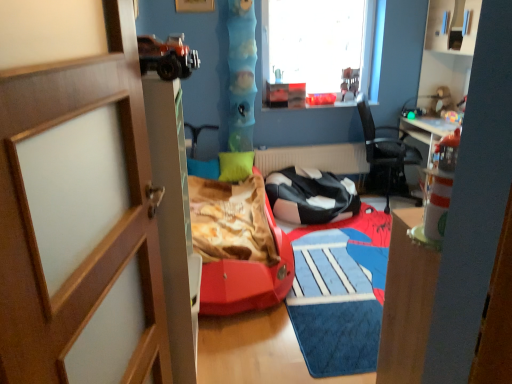
Question: From the image's perspective, is green matte pillow at center under transparent glass window at upper center?

Choices:
 (A) no
 (B) yes

Answer: (B)

Question: Is green matte pillow at center in front of transparent glass window at upper center?

Choices:
 (A) yes
 (B) no

Answer: (A)

Question: Would you say green matte pillow at center contains transparent glass window at upper center?

Choices:
 (A) yes
 (B) no

Answer: (B)

Question: From the image's perspective, is green matte pillow at center on transparent glass window at upper center?

Choices:
 (A) no
 (B) yes

Answer: (A)

Question: Does green matte pillow at center have a greater height compared to transparent glass window at upper center?

Choices:
 (A) yes
 (B) no

Answer: (B)

Question: Could you tell me if green matte pillow at center is turned towards transparent glass window at upper center?

Choices:
 (A) no
 (B) yes

Answer: (A)

Question: Is black leather chair at center, which is the 1th chair in left-to-right order, at the right side of matte plastic toy at upper right, the 2th toy from the left?

Choices:
 (A) yes
 (B) no

Answer: (B)

Question: Are black leather chair at center, which is the 1th chair in left-to-right order, and matte plastic toy at upper right, placed as the first toy when sorted from right to left, beside each other?

Choices:
 (A) yes
 (B) no

Answer: (B)

Question: Is black leather chair at center, the 2th chair when ordered from right to left, positioned in front of matte plastic toy at upper right, placed as the first toy when sorted from right to left?

Choices:
 (A) yes
 (B) no

Answer: (A)

Question: Considering the relative sizes of black leather chair at center, the 2th chair when ordered from right to left, and matte plastic toy at upper right, placed as the first toy when sorted from right to left, in the image provided, is black leather chair at center, the 2th chair when ordered from right to left, shorter than matte plastic toy at upper right, placed as the first toy when sorted from right to left,?

Choices:
 (A) no
 (B) yes

Answer: (A)

Question: From the image's perspective, is black leather chair at center, the 2th chair when ordered from right to left, located above matte plastic toy at upper right, placed as the first toy when sorted from right to left?

Choices:
 (A) yes
 (B) no

Answer: (B)

Question: Is the position of black leather chair at center, the 2th chair when ordered from right to left, more distant than that of matte plastic toy at upper right, the 2th toy from the left?

Choices:
 (A) no
 (B) yes

Answer: (A)

Question: Is black mesh chair at center, marked as the first chair in a right-to-left arrangement, completely or partially outside of wooden door at left?

Choices:
 (A) no
 (B) yes

Answer: (B)